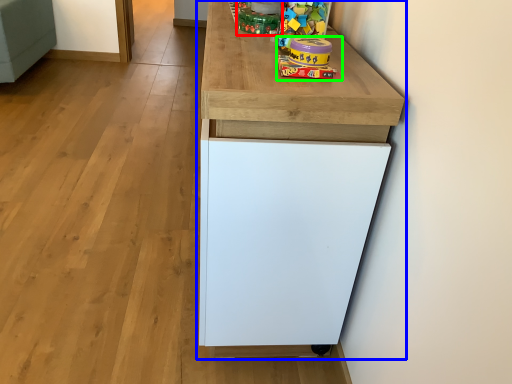
Question: Considering the real-world distances, which object is closest to toy (highlighted by a red box)? cabinetry (highlighted by a blue box) or toy (highlighted by a green box).

Choices:
 (A) cabinetry
 (B) toy

Answer: (B)